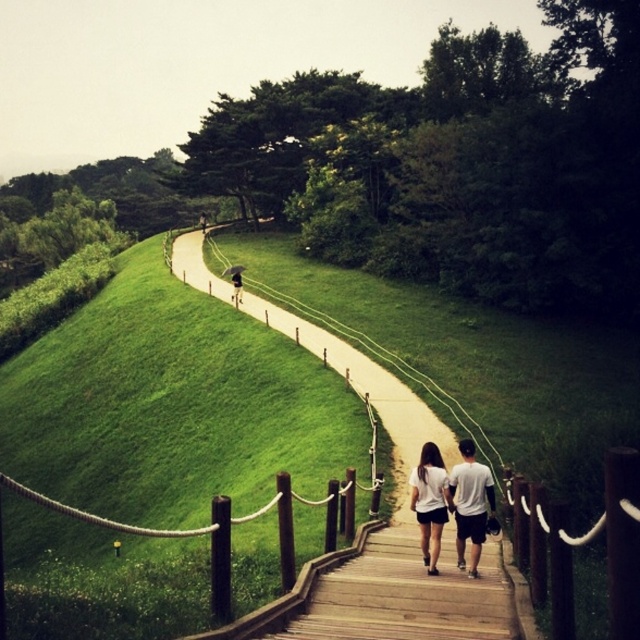
Question: Does green grassy hillside at upper left have a smaller size compared to wooden pathway at center?

Choices:
 (A) no
 (B) yes

Answer: (A)

Question: Is white cotton shirt at center closer to camera compared to white matte shirt at center?

Choices:
 (A) yes
 (B) no

Answer: (A)

Question: Which object is positioned closest to the green grassy hillside at upper left?

Choices:
 (A) white cotton shirt at center
 (B) dark blue jeans at center

Answer: (A)

Question: Which point is closer to the camera?

Choices:
 (A) dark blue jeans at center
 (B) green grassy hillside at upper left
 (C) wooden pathway at center

Answer: (B)

Question: Which of the following is the closest to the observer?

Choices:
 (A) green grassy hillside at upper left
 (B) white matte shirt at center
 (C) wooden pathway at center
 (D) dark blue jeans at center

Answer: (A)

Question: Can you confirm if green grassy hillside at upper left is positioned to the left of wooden pathway at center?

Choices:
 (A) no
 (B) yes

Answer: (B)